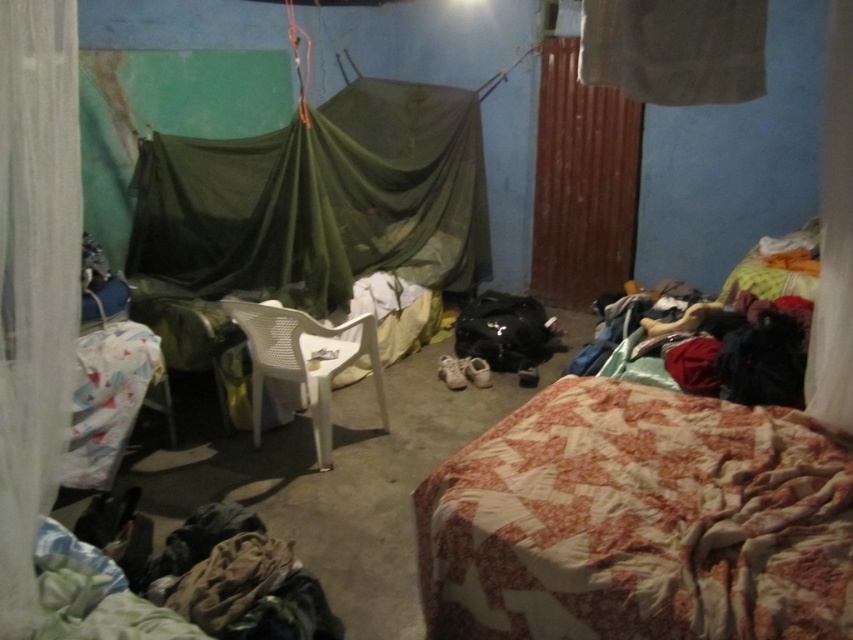
Who is positioned more to the right, green netting canopy at center or white sheer curtain at left?

green netting canopy at center

Is point (457, 168) farther from camera compared to point (28, 236)?

Yes, point (457, 168) is farther from viewer.

The height and width of the screenshot is (640, 853). In order to click on green netting canopy at center in this screenshot , I will do `click(318, 200)`.

The image size is (853, 640). What are the coordinates of `green netting canopy at center` in the screenshot? It's located at (318, 200).

Is patchwork quilted bed at lower right in front of white plastic chair at center?

Yes, it is in front of white plastic chair at center.

Which is more to the right, patchwork quilted bed at lower right or white plastic chair at center?

patchwork quilted bed at lower right

Is point (515, 486) closer to viewer compared to point (259, 320)?

Yes, point (515, 486) is in front of point (259, 320).

The width and height of the screenshot is (853, 640). In order to click on patchwork quilted bed at lower right in this screenshot , I will do `click(639, 522)`.

Does green netting canopy at center have a greater height compared to white sheer curtain at right?

Indeed, green netting canopy at center has a greater height compared to white sheer curtain at right.

Who is more distant from viewer, (476, 275) or (825, 150)?

The point (476, 275) is more distant.

Between point (395, 196) and point (836, 365), which one is positioned behind?

Positioned behind is point (395, 196).

The image size is (853, 640). Find the location of `green netting canopy at center`. green netting canopy at center is located at coordinates (318, 200).